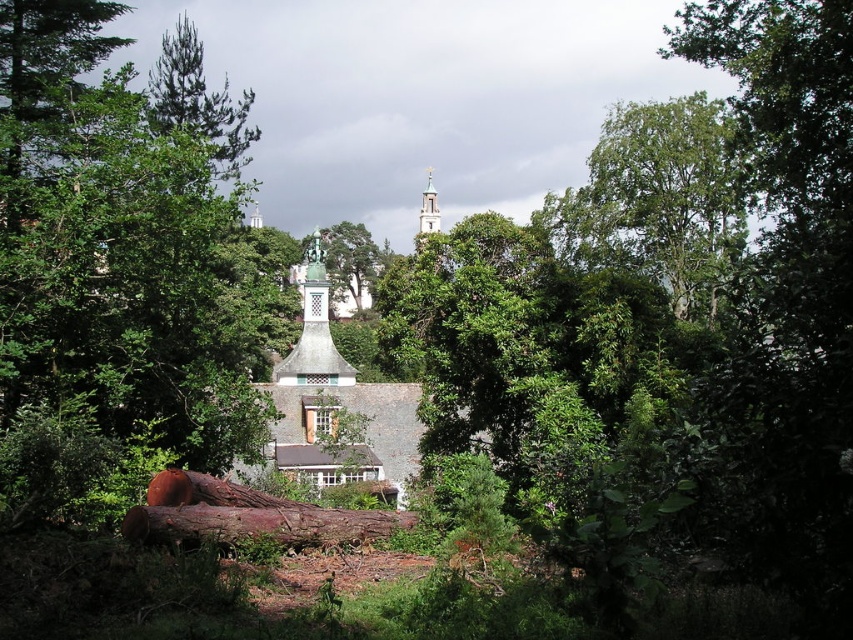
In the scene shown: Between green leafy tree at lower left and green stone tower at upper center, which one appears on the left side from the viewer's perspective?

green leafy tree at lower left

Which is more to the right, green leafy tree at lower left or green stone tower at upper center?

From the viewer's perspective, green stone tower at upper center appears more on the right side.

Find the location of `green leafy tree at lower left`. green leafy tree at lower left is located at coordinates click(x=122, y=268).

Identify the location of green leafy tree at lower left. Image resolution: width=853 pixels, height=640 pixels. (122, 268).

Between point (99, 154) and point (238, 534), which one is positioned behind?

Positioned behind is point (99, 154).

Where is `green leafy tree at lower left`? green leafy tree at lower left is located at coordinates (122, 268).

Can you confirm if brown rough wood log at lower center is shorter than green needle-like at upper left?

Correct, brown rough wood log at lower center is not as tall as green needle-like at upper left.

Between brown rough wood log at lower center and green needle-like at upper left, which one has more height?

Standing taller between the two is green needle-like at upper left.

The width and height of the screenshot is (853, 640). In order to click on brown rough wood log at lower center in this screenshot , I will do `click(260, 524)`.

What are the coordinates of `brown rough wood log at lower center` in the screenshot? It's located at (260, 524).